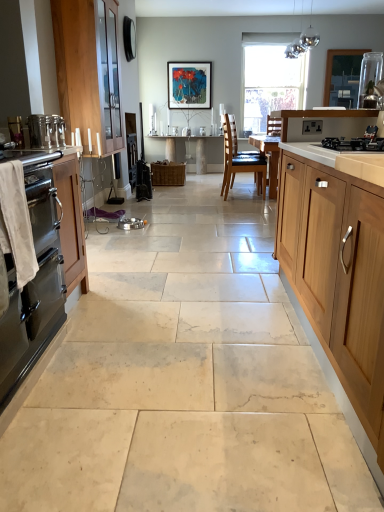
You are a GUI agent. You are given a task and a screenshot of the screen. Output one action in this format:
    pyautogui.click(x=<x>, y=<y>)
    Task: Click on the vacant area that is situated to the right of satin black oven at left, the 2th cabinetry viewed from the left
    Image resolution: width=384 pixels, height=512 pixels.
    Given the screenshot: What is the action you would take?
    pyautogui.click(x=133, y=384)